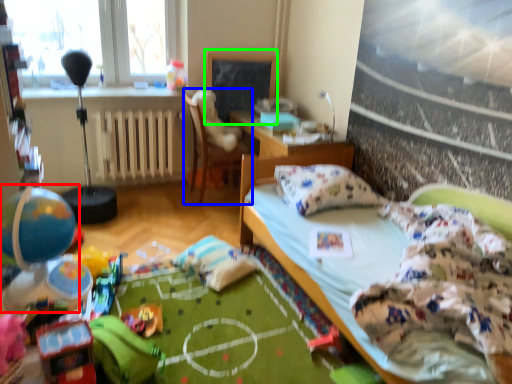
Question: Which object is the farthest from toy (highlighted by a red box)? Choose among these: chair (highlighted by a blue box) or bulletin board (highlighted by a green box).

Choices:
 (A) chair
 (B) bulletin board

Answer: (B)